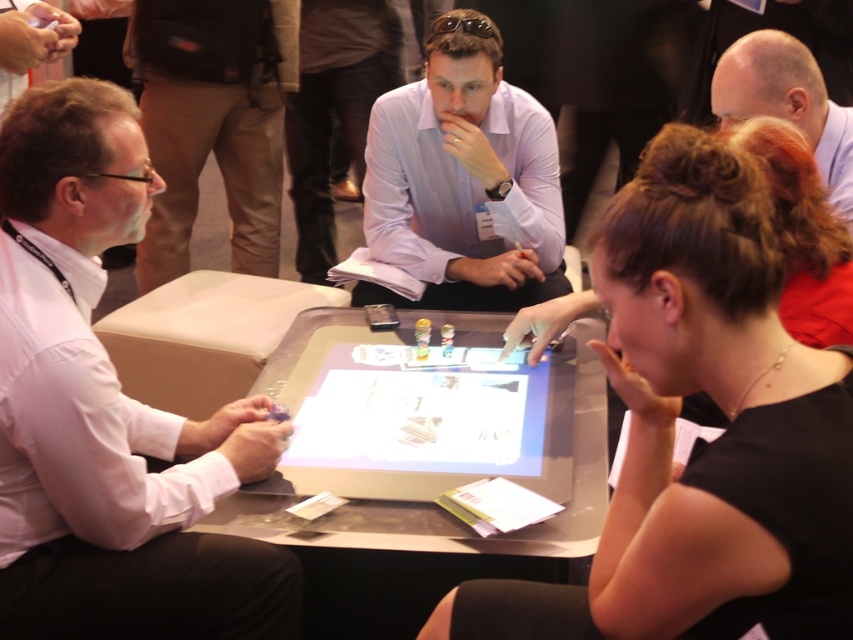
You are standing in the room and looking at the two people in the image. Which person has their head positioned lower relative to the other? The black matte hair at center and the bald head at upper right.

The black matte hair at center is positioned below the bald head at upper right, so the person with black matte hair at center has their head lower.

Based on the photo, you are standing at the back of the room and want to see the person in the light purple shirt at center. Is there any obstruction from the transparent glass table at center?

The light purple shirt at center has a greater height compared to the transparent glass table at center, so the table won not obstruct your view of the person in the light purple shirt at center.

You are a photographer trying to capture a group photo of the black matte hair at center and the bald head at upper right. The camera you are using has a minimum focusing distance of 1 meter. Will you be able to take a clear photo of both subjects without moving the camera or the subjects?

The distance between the black matte hair at center and the bald head at upper right is 92.45 centimeters, which is less than the camera minimum focusing distance of 1 meter. Therefore, you will not be able to take a clear photo of both subjects without adjusting the camera or moving them.